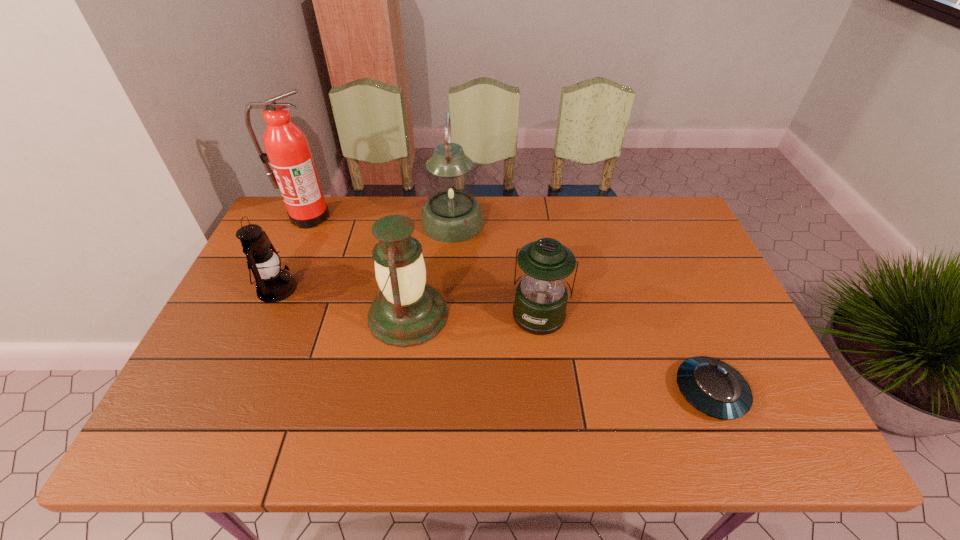
I want to click on object that is at the far left corner, so click(293, 171).

The height and width of the screenshot is (540, 960). I want to click on object at the near right corner, so click(713, 387).

In the image, there is a desktop. Find the location of `vacant space at the far edge`. vacant space at the far edge is located at coordinates (621, 210).

This screenshot has width=960, height=540. In the image, there is a desktop. What are the coordinates of `free region at the left edge` in the screenshot? It's located at (248, 390).

This screenshot has width=960, height=540. Identify the location of free space at the right edge of the desktop. (755, 393).

You are a GUI agent. You are given a task and a screenshot of the screen. Output one action in this format:
    pyautogui.click(x=<x>, y=<y>)
    Task: Click on the vacant space at the far left corner of the desktop
    Image resolution: width=960 pixels, height=540 pixels.
    Given the screenshot: What is the action you would take?
    pyautogui.click(x=276, y=234)

Find the location of a particular element. The width and height of the screenshot is (960, 540). free spot at the near left corner of the desktop is located at coordinates (201, 447).

In the image, there is a desktop. Find the location of `vacant space at the far right corner`. vacant space at the far right corner is located at coordinates (676, 234).

Identify the location of free space between the nearest object and the fire extinguisher. (509, 304).

Where is `free spot between the rightmost lantern and the second tallest object`? This screenshot has height=540, width=960. free spot between the rightmost lantern and the second tallest object is located at coordinates (496, 268).